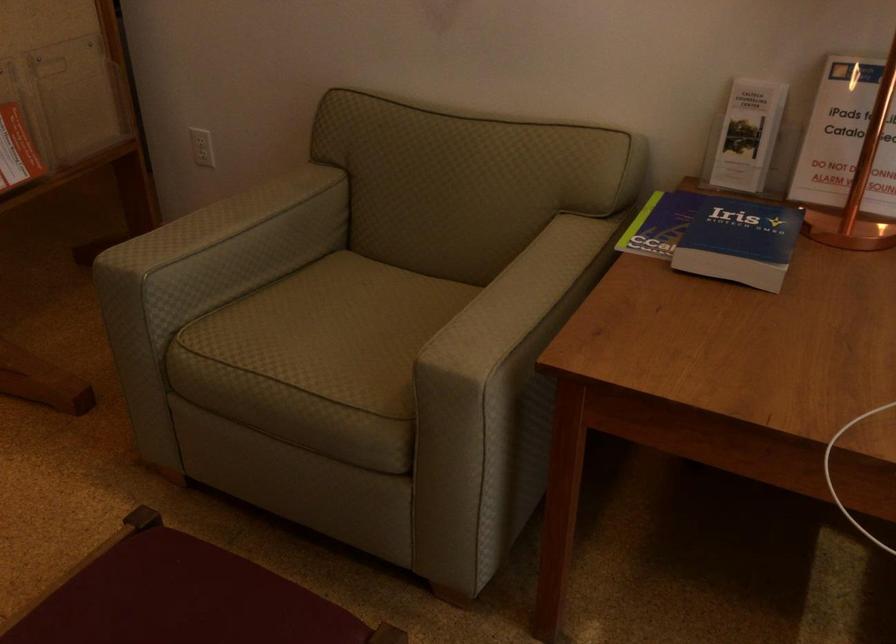
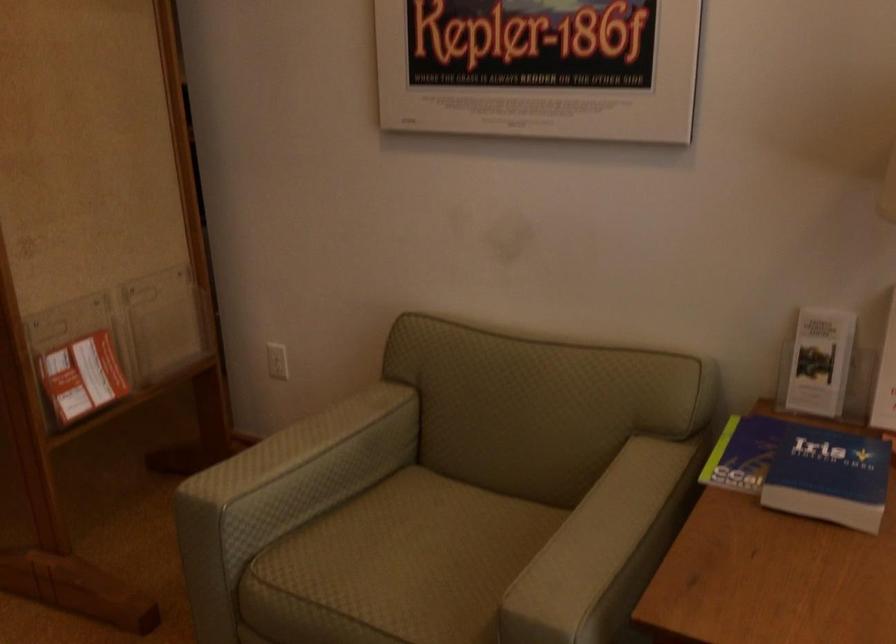
Locate, in the second image, the point that corresponds to point (739, 236) in the first image.

(829, 476)